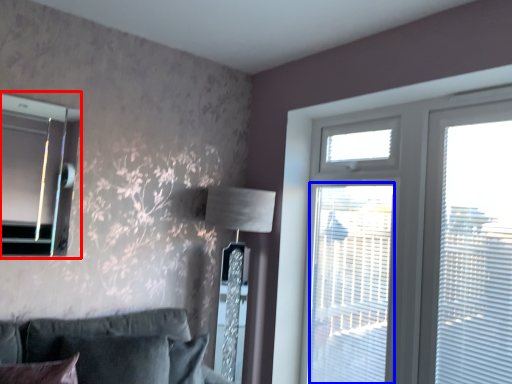
Question: Which of the following is the farthest to the observer, bay window (highlighted by a red box) or screen door (highlighted by a blue box)?

Choices:
 (A) bay window
 (B) screen door

Answer: (B)